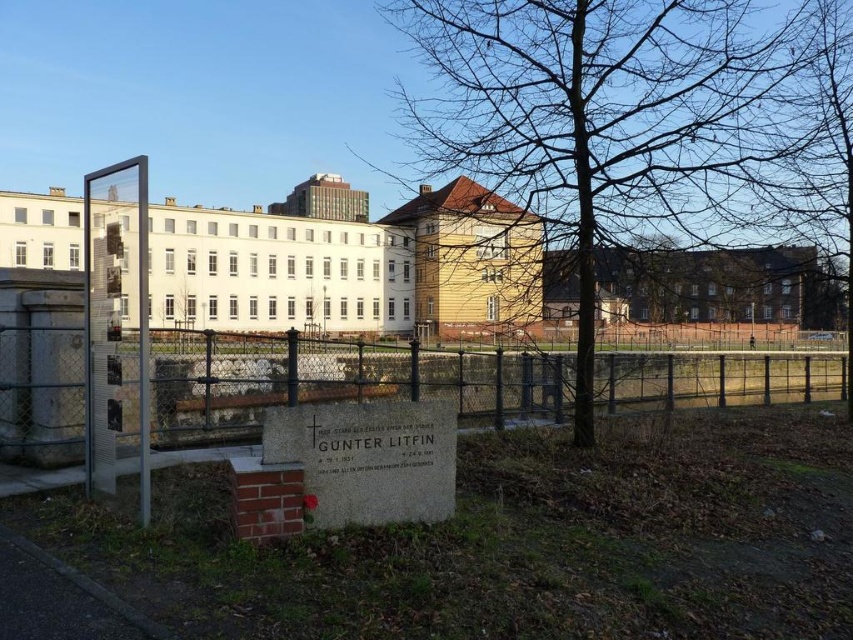
You are standing at the memorial stone and want to place a wreath at the point marked by point (653, 80). However, there is an obstacle at point (33, 326). Can you reach the desired point without going around the obstacle?

Point (653, 80) is behind point (33, 326), so you cannot reach the desired point directly without moving around the obstacle at point (33, 326).